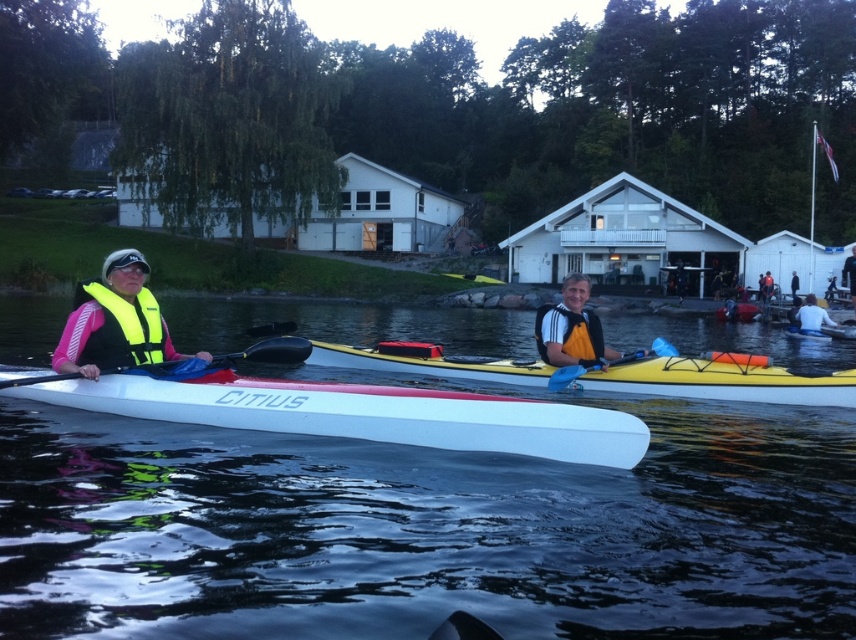
Question: Which point is closer to the camera taking this photo?

Choices:
 (A) (223, 356)
 (B) (652, 352)
 (C) (254, 401)
 (D) (128, 310)

Answer: (C)

Question: Does white matte canoe at center lie behind matte red canoe at center?

Choices:
 (A) yes
 (B) no

Answer: (B)

Question: Which object appears farthest from the camera in this image?

Choices:
 (A) matte red canoe at center
 (B) white matte kayak at right

Answer: (A)

Question: Does yellow/orange life vest at center have a larger size compared to white matte kayak at right?

Choices:
 (A) yes
 (B) no

Answer: (B)

Question: From the image, what is the correct spatial relationship of blue plastic paddle at center in relation to matte red canoe at center?

Choices:
 (A) above
 (B) below

Answer: (B)

Question: Which object is positioned farthest from the blue plastic paddle at center?

Choices:
 (A) yellow/orange life vest at center
 (B) white matte canoe at center
 (C) white glossy kayak at left

Answer: (C)